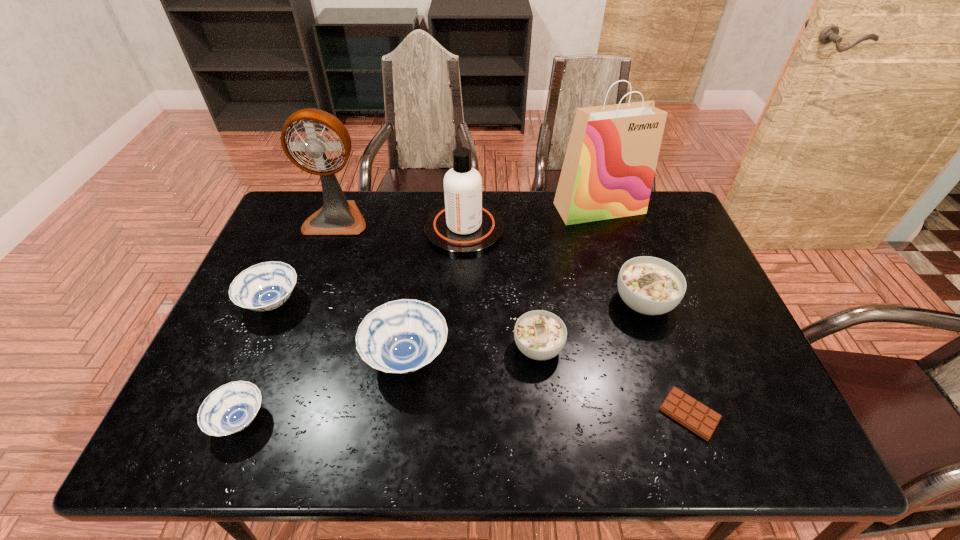
Find the location of a particular element. The image size is (960, 540). soup bowl at the right edge is located at coordinates (649, 285).

Locate an element on the screen. Image resolution: width=960 pixels, height=540 pixels. candy bar present at the right edge is located at coordinates (700, 419).

Find the location of a particular element. The image size is (960, 540). object located at the far left corner is located at coordinates (338, 216).

You are a GUI agent. You are given a task and a screenshot of the screen. Output one action in this format:
    pyautogui.click(x=<x>, y=<y>)
    Task: Click on the object that is at the near left corner
    This screenshot has height=540, width=960.
    Given the screenshot: What is the action you would take?
    pyautogui.click(x=229, y=409)

This screenshot has width=960, height=540. In order to click on object located at the far right corner in this screenshot , I will do `click(608, 171)`.

I want to click on object at the near right corner, so click(x=700, y=419).

Locate an element on the screen. This screenshot has width=960, height=540. free point at the far edge is located at coordinates click(x=531, y=190).

The image size is (960, 540). I want to click on vacant area at the near edge of the desktop, so click(397, 433).

Where is `vacant space at the left edge`? This screenshot has height=540, width=960. vacant space at the left edge is located at coordinates (274, 245).

This screenshot has width=960, height=540. In order to click on blank space at the right edge of the desktop in this screenshot , I will do `click(682, 245)`.